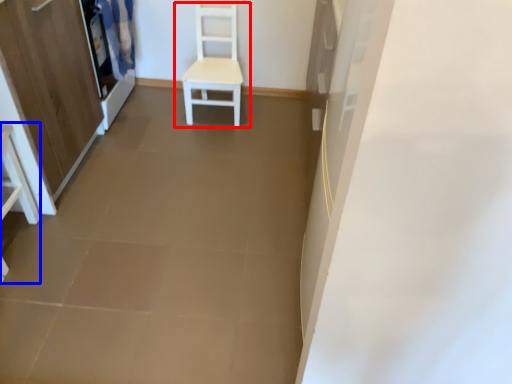
Question: Which object appears closest to the camera in this image, chair (highlighted by a red box) or vanity (highlighted by a blue box)?

Choices:
 (A) chair
 (B) vanity

Answer: (B)